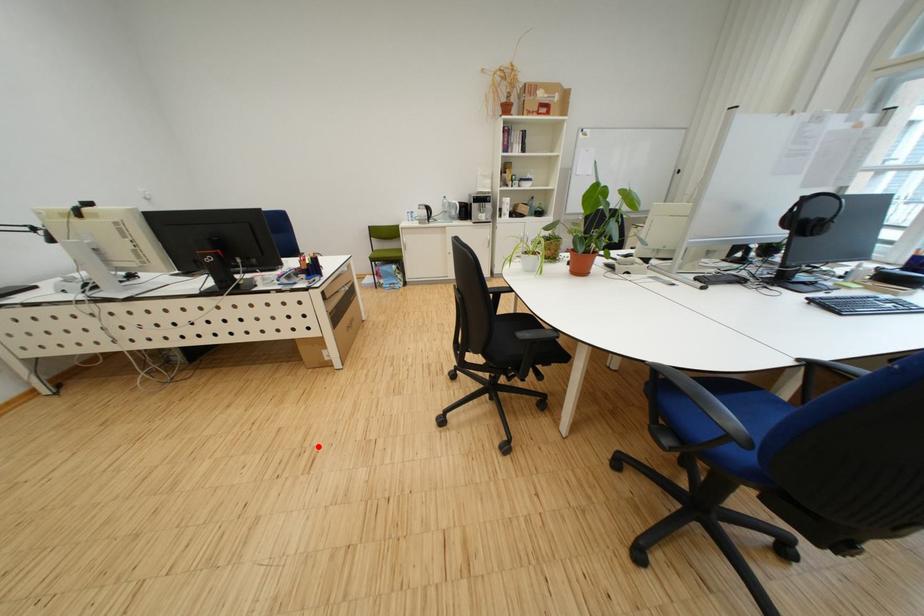
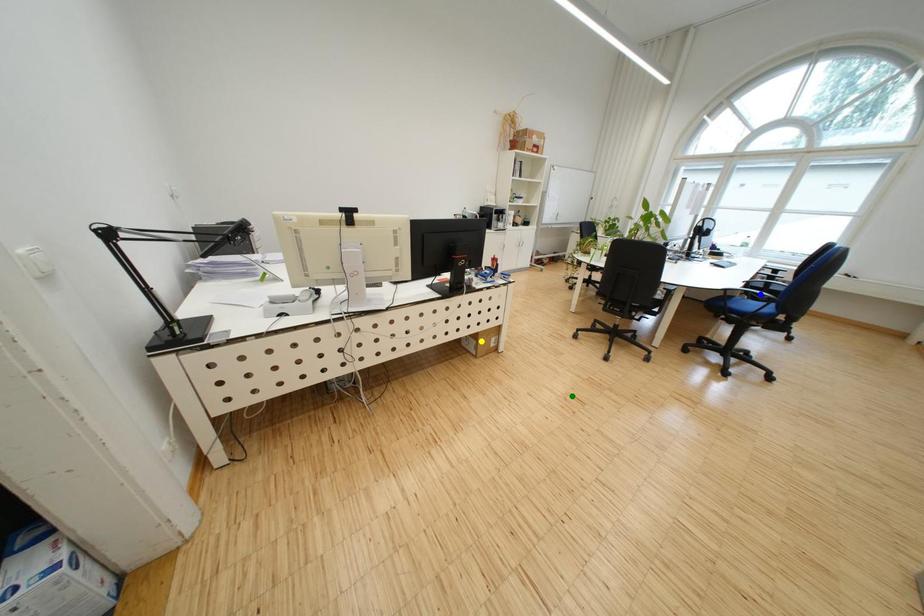
Question: I am providing you with two images of the same scene from different viewpoints. A red point is marked on the first image. You are given multiple points on the second image. Which mark in image 2 goes with the point in image 1?

Choices:
 (A) yellow point
 (B) green point
 (C) blue point

Answer: (B)